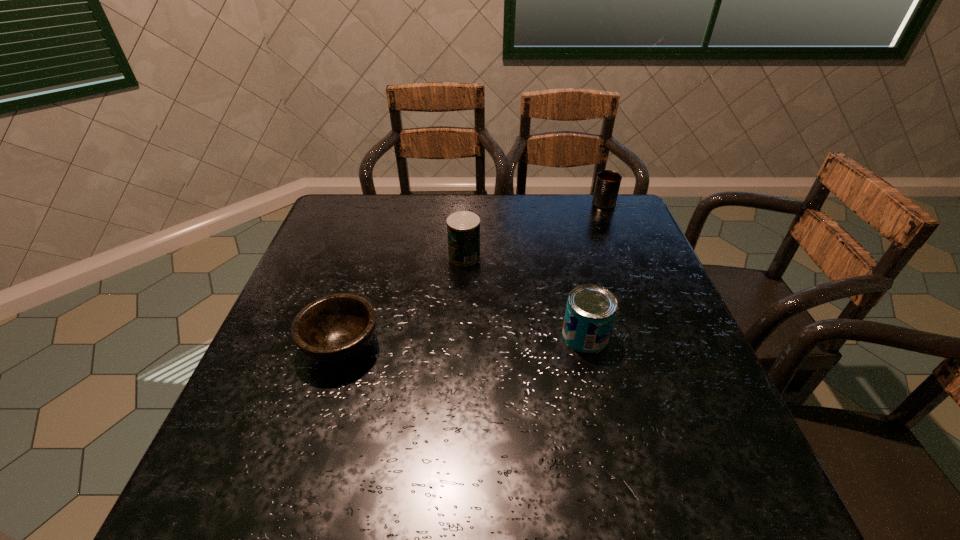
Locate an element on the screen. The image size is (960, 540). free area in between the leftmost object and the leftmost can is located at coordinates (403, 301).

Where is `vacant space that's between the rightmost can and the leftmost object`? This screenshot has width=960, height=540. vacant space that's between the rightmost can and the leftmost object is located at coordinates (472, 275).

The height and width of the screenshot is (540, 960). Find the location of `unoccupied area between the third object from left to right and the bowl`. unoccupied area between the third object from left to right and the bowl is located at coordinates (464, 341).

I want to click on object that stands as the closest to the third object from left to right, so click(463, 227).

Find the location of a particular element. object that is the second closest one to the second farthest can is located at coordinates (590, 311).

At what (x,y) coordinates should I click in order to perform the action: click on can that is the second closest to the farthest object. Please return your answer as a coordinate pair (x, y). The width and height of the screenshot is (960, 540). Looking at the image, I should click on (590, 311).

Locate an element on the screen. The width and height of the screenshot is (960, 540). can identified as the second closest to the farthest object is located at coordinates (590, 311).

The image size is (960, 540). I want to click on blank area in the image that satisfies the following two spatial constraints: 1. on the back side of the farthest can; 2. on the right side of the second farthest can, so click(x=467, y=204).

I want to click on vacant point that satisfies the following two spatial constraints: 1. on the back side of the rightmost object; 2. on the left side of the third nearest object, so click(467, 204).

You are a GUI agent. You are given a task and a screenshot of the screen. Output one action in this format:
    pyautogui.click(x=<x>, y=<y>)
    Task: Click on the vacant space that satisfies the following two spatial constraints: 1. on the back side of the bowl; 2. on the right side of the third object from left to right
    
    Given the screenshot: What is the action you would take?
    pyautogui.click(x=345, y=336)